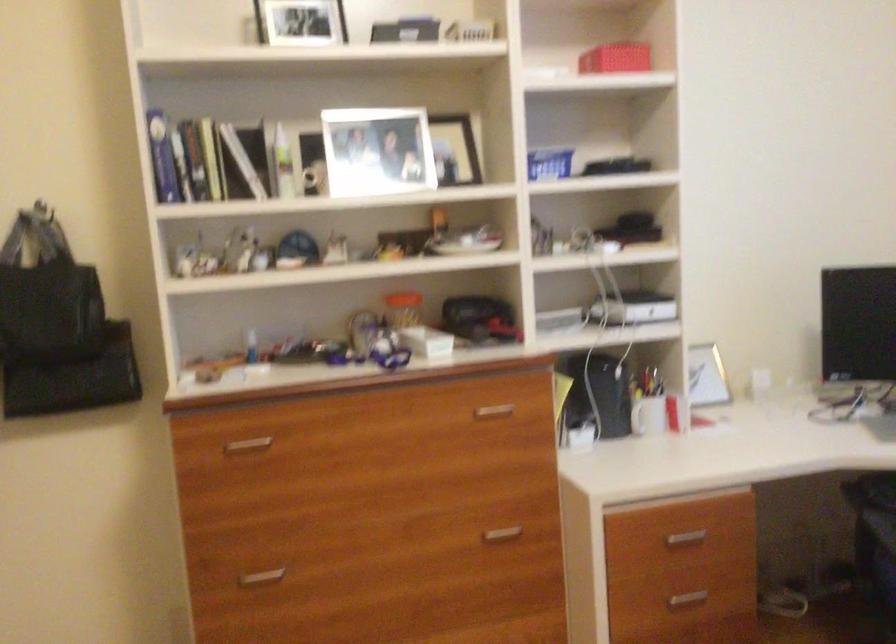
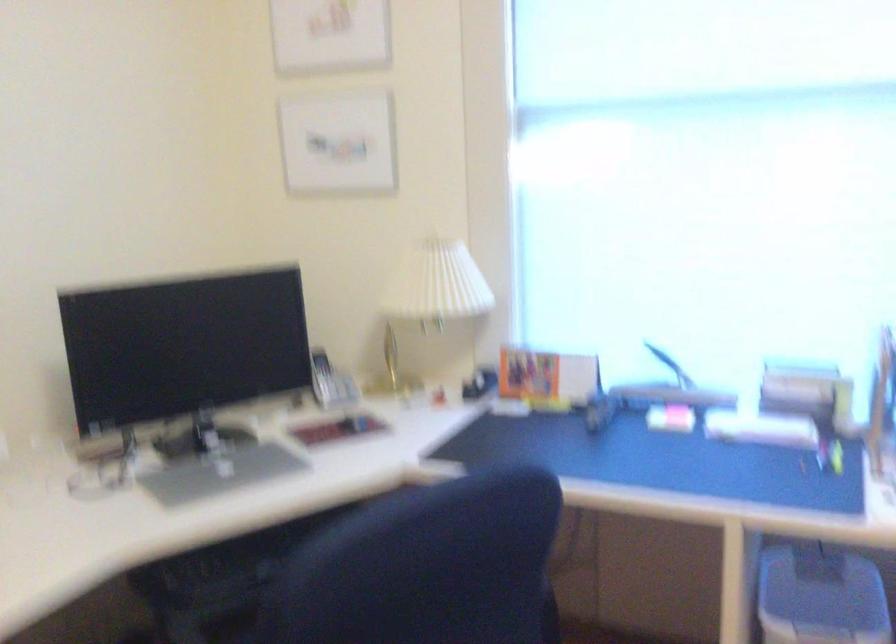
Question: The camera is either moving clockwise (left) or counter-clockwise (right) around the object. The first image is from the beginning of the video and the second image is from the end. Is the camera moving left or right when shooting the video?

Choices:
 (A) Left
 (B) Right

Answer: (A)